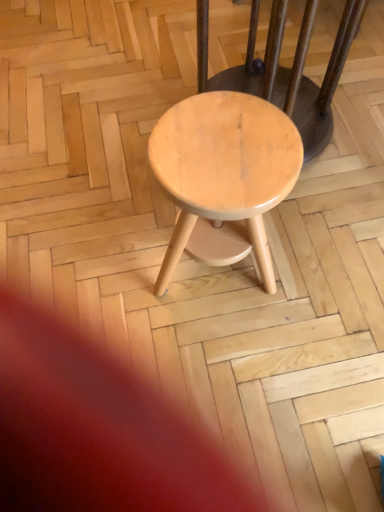
Where is `natural wood stool at center`? This screenshot has width=384, height=512. natural wood stool at center is located at coordinates (245, 130).

The height and width of the screenshot is (512, 384). What do you see at coordinates (245, 130) in the screenshot? I see `natural wood stool at center` at bounding box center [245, 130].

The height and width of the screenshot is (512, 384). Identify the location of natural wood stool at center. (245, 130).